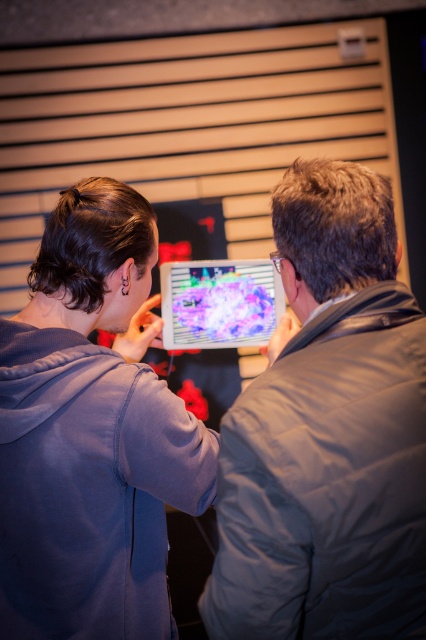
Does matte purple hoodie at center have a lesser height compared to shiny plastic tablet at center?

In fact, matte purple hoodie at center may be taller than shiny plastic tablet at center.

Is matte purple hoodie at center taller than shiny plastic tablet at center?

Correct, matte purple hoodie at center is much taller as shiny plastic tablet at center.

Is point (57, 275) positioned in front of point (253, 292)?

Yes, point (57, 275) is in front of point (253, 292).

What are the coordinates of `matte purple hoodie at center` in the screenshot? It's located at (91, 435).

Consider the image. Is gray puffy jacket at center to the right of shiny plastic tablet at center from the viewer's perspective?

Indeed, gray puffy jacket at center is positioned on the right side of shiny plastic tablet at center.

Which is more to the right, gray puffy jacket at center or shiny plastic tablet at center?

gray puffy jacket at center

What are the coordinates of `gray puffy jacket at center` in the screenshot? It's located at 328,433.

You are a GUI agent. You are given a task and a screenshot of the screen. Output one action in this format:
    pyautogui.click(x=<x>, y=<y>)
    Task: Click on the gray puffy jacket at center
    This screenshot has height=640, width=426.
    Given the screenshot: What is the action you would take?
    pyautogui.click(x=328, y=433)

Image resolution: width=426 pixels, height=640 pixels. Identify the location of gray puffy jacket at center. (328, 433).

Does point (259, 636) come in front of point (5, 458)?

Yes, it is.

Locate an element on the screen. gray puffy jacket at center is located at coordinates (328, 433).